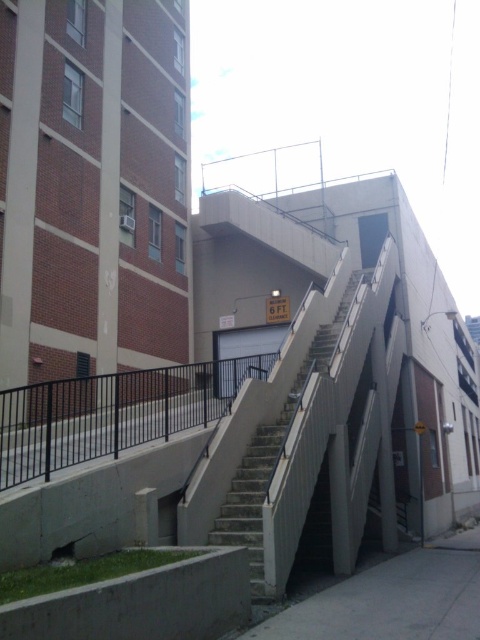
Question: Which object is the closest to the concrete stairs at center?

Choices:
 (A) black metal railing at lower left
 (B) gray concrete pavement at lower center

Answer: (B)

Question: Can you confirm if black metal railing at lower left is wider than gray concrete pavement at lower center?

Choices:
 (A) no
 (B) yes

Answer: (B)

Question: Is black metal railing at lower left positioned in front of concrete stairs at center?

Choices:
 (A) no
 (B) yes

Answer: (B)

Question: Is black metal railing at lower left to the left of concrete stairs at center from the viewer's perspective?

Choices:
 (A) yes
 (B) no

Answer: (A)

Question: Estimate the real-world distances between objects in this image. Which object is closer to the black metal railing at lower left?

Choices:
 (A) concrete stairs at center
 (B) gray concrete pavement at lower center

Answer: (A)

Question: Which point is farther to the camera?

Choices:
 (A) black metal railing at lower left
 (B) concrete stairs at center
 (C) gray concrete pavement at lower center

Answer: (B)